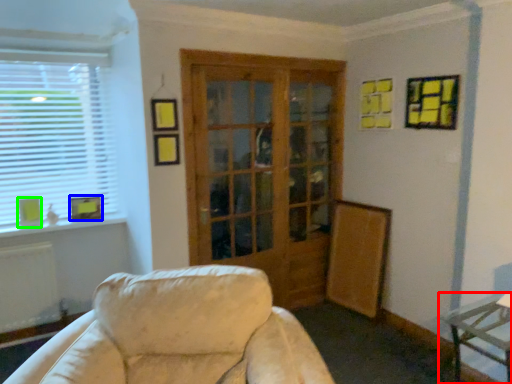
Question: Which is nearer to the table (highlighted by a red box)? picture frame (highlighted by a blue box) or picture frame (highlighted by a green box).

Choices:
 (A) picture frame
 (B) picture frame

Answer: (A)